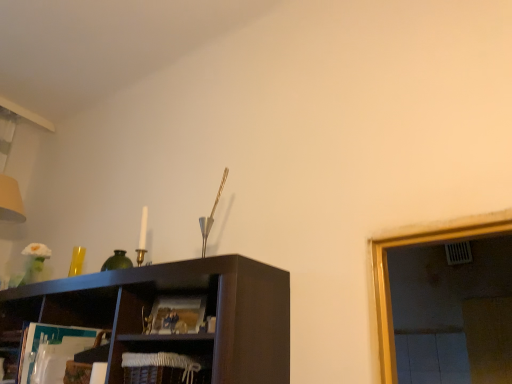
Question: Is woven brown basket at lower center inside matte brown magazine at center?

Choices:
 (A) no
 (B) yes

Answer: (A)

Question: From the image's perspective, is matte brown magazine at center located beneath woven brown basket at lower center?

Choices:
 (A) no
 (B) yes

Answer: (A)

Question: Is matte brown magazine at center not close to woven brown basket at lower center?

Choices:
 (A) yes
 (B) no

Answer: (B)

Question: Is matte brown magazine at center in contact with woven brown basket at lower center?

Choices:
 (A) no
 (B) yes

Answer: (A)

Question: Considering the relative sizes of matte brown magazine at center and woven brown basket at lower center in the image provided, is matte brown magazine at center thinner than woven brown basket at lower center?

Choices:
 (A) no
 (B) yes

Answer: (B)

Question: From a real-world perspective, is matte brown magazine at center physically below woven brown basket at lower center?

Choices:
 (A) yes
 (B) no

Answer: (B)

Question: Does woven brown basket at lower center have a lesser height compared to matte brown magazine at center?

Choices:
 (A) no
 (B) yes

Answer: (A)

Question: Considering the relative sizes of woven brown basket at lower center and matte brown magazine at center in the image provided, is woven brown basket at lower center thinner than matte brown magazine at center?

Choices:
 (A) yes
 (B) no

Answer: (B)

Question: From a real-world perspective, is woven brown basket at lower center positioned under matte brown magazine at center based on gravity?

Choices:
 (A) yes
 (B) no

Answer: (A)

Question: Is woven brown basket at lower center located outside matte brown magazine at center?

Choices:
 (A) yes
 (B) no

Answer: (A)

Question: Is woven brown basket at lower center looking in the opposite direction of matte brown magazine at center?

Choices:
 (A) no
 (B) yes

Answer: (A)

Question: Considering the relative positions of woven brown basket at lower center and matte brown magazine at center in the image provided, is woven brown basket at lower center to the right of matte brown magazine at center from the viewer's perspective?

Choices:
 (A) no
 (B) yes

Answer: (A)

Question: Is matte brown magazine at center bigger or smaller than woven brown basket at lower center?

Choices:
 (A) big
 (B) small

Answer: (B)